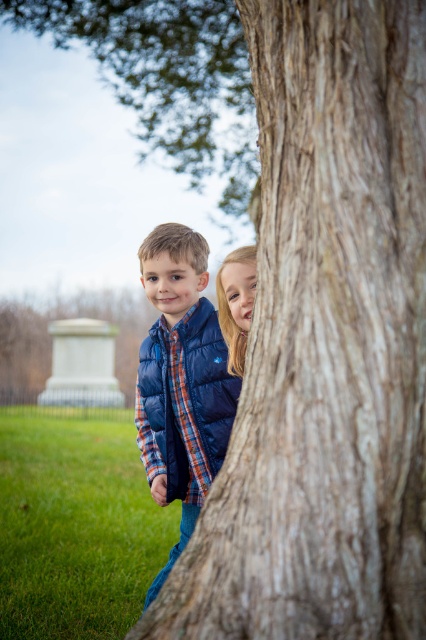
You are a photographer trying to capture a clear shot of the navy blue puffer vest at center. However, the brown rough bark tree at upper center is blocking part of the vest. Can you estimate whether the tree is wider than the vest? Use the information provided to determine this.

The brown rough bark tree at upper center might be wider than the navy blue puffer vest at center, so there is a possibility that the tree is blocking more of the vest due to its potential width.

You are standing in the outdoor scene described. There is a point marked at coordinates (167, 76). Which object in the scene does this point correspond to?

The point at coordinates (167, 76) corresponds to the brown rough bark tree at upper center.